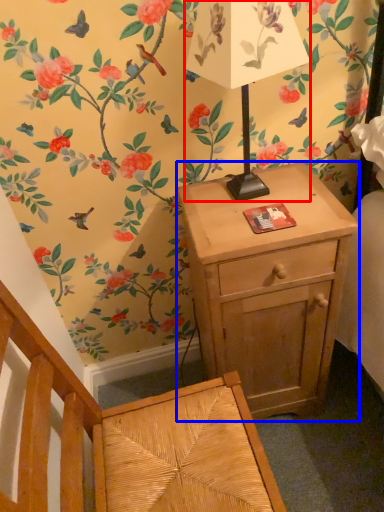
Question: Among these objects, which one is nearest to the camera, table lamp (highlighted by a red box) or nightstand (highlighted by a blue box)?

Choices:
 (A) table lamp
 (B) nightstand

Answer: (A)